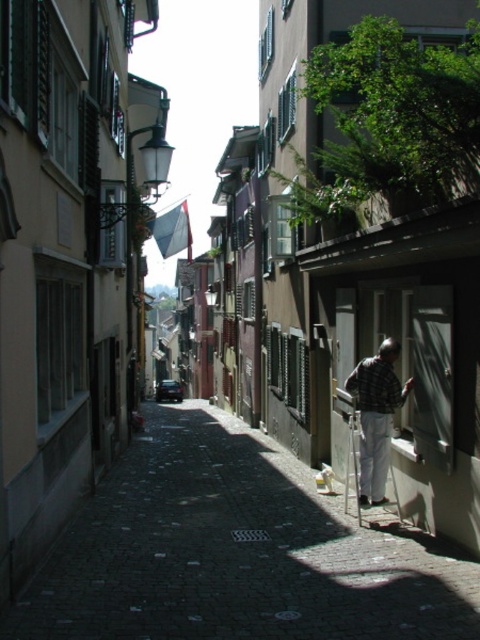
Question: Based on their relative distances, which object is nearer to the checkered fabric shirt at right?

Choices:
 (A) smooth cobblestone street at center
 (B) metallic silver ladder at lower right

Answer: (B)

Question: Which object is the farthest from the metallic silver ladder at lower right?

Choices:
 (A) checkered fabric shirt at right
 (B) smooth cobblestone street at center

Answer: (B)

Question: Can you confirm if smooth cobblestone street at center is positioned below checkered fabric shirt at right?

Choices:
 (A) no
 (B) yes

Answer: (B)

Question: Based on their relative distances, which object is farther from the checkered fabric shirt at right?

Choices:
 (A) metallic silver ladder at lower right
 (B) smooth cobblestone street at center

Answer: (B)

Question: Does checkered fabric shirt at right come behind metallic silver ladder at lower right?

Choices:
 (A) no
 (B) yes

Answer: (A)

Question: Does checkered fabric shirt at right appear under metallic silver ladder at lower right?

Choices:
 (A) no
 (B) yes

Answer: (A)